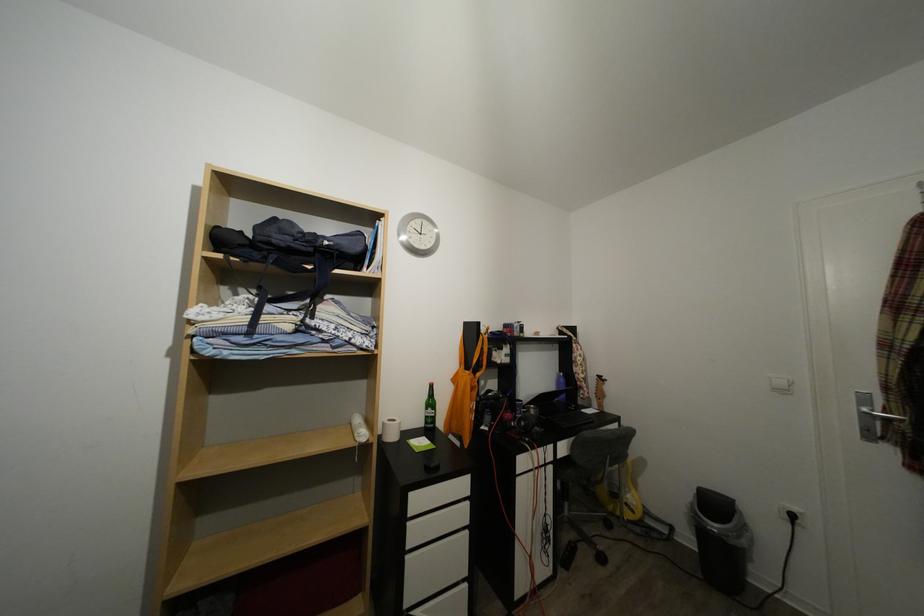
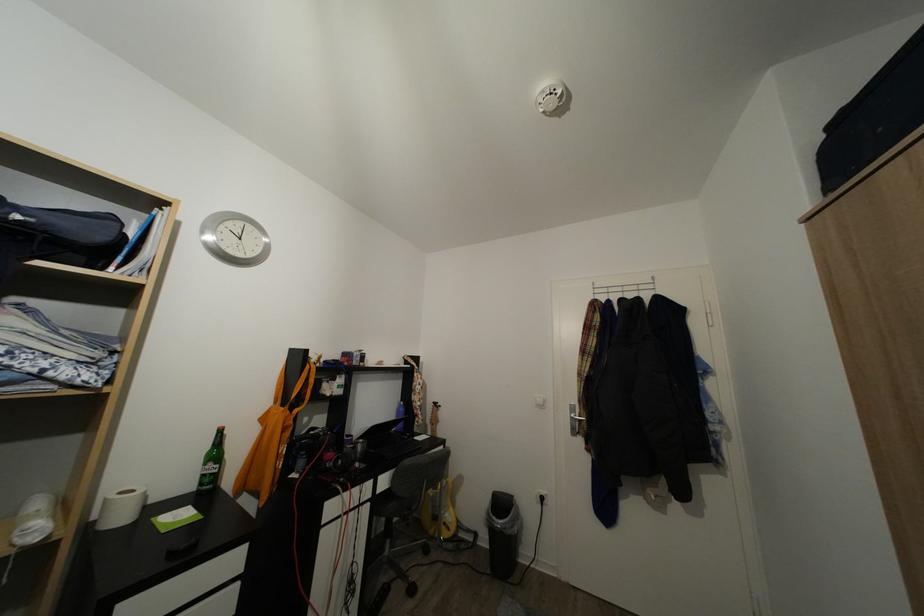
Where in the second image is the point corresponding to [723,512] from the first image?

(509, 511)